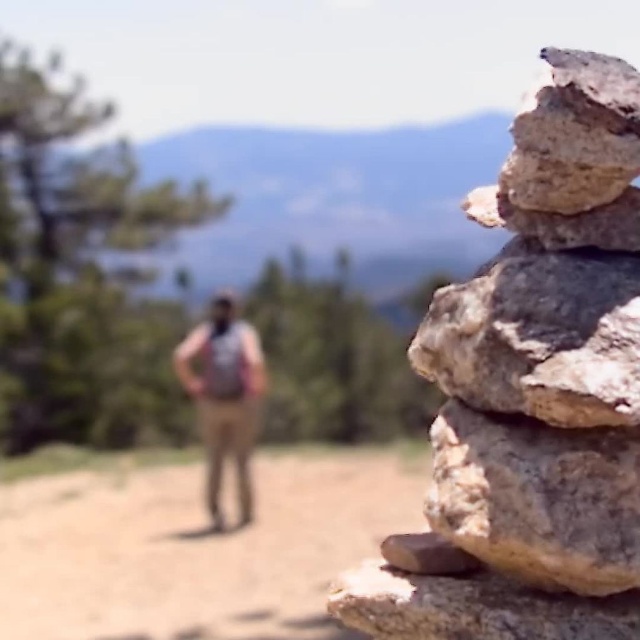
You are an outdoor photographer trying to capture a shot of the green leafy pine at upper left and the gray rough rock at right. Which object should you zoom in on to make them appear the same size in your photo?

To make the green leafy pine at upper left and the gray rough rock at right appear the same size in your photo, you should zoom in on the gray rough rock at right since it is smaller than the green leafy pine at upper left.